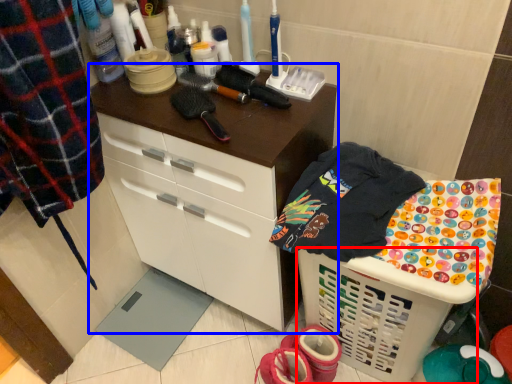
Question: Which object is closer to the camera taking this photo, basket (highlighted by a red box) or cabinetry (highlighted by a blue box)?

Choices:
 (A) basket
 (B) cabinetry

Answer: (A)